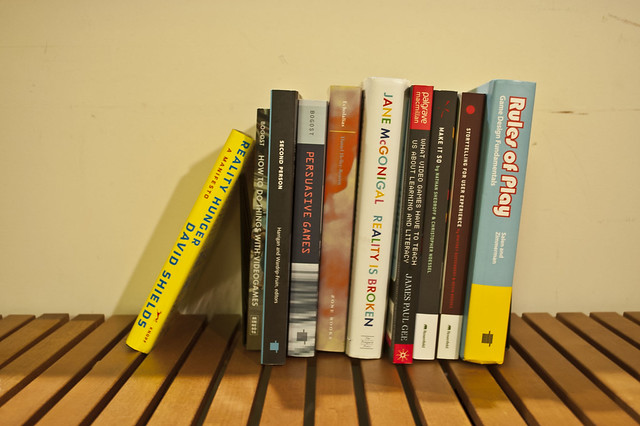
This screenshot has height=426, width=640. I want to click on book, so click(490, 190), click(470, 189), click(449, 189), click(427, 189), click(379, 183), click(337, 184), click(306, 184), click(284, 184), click(252, 189), click(226, 190).